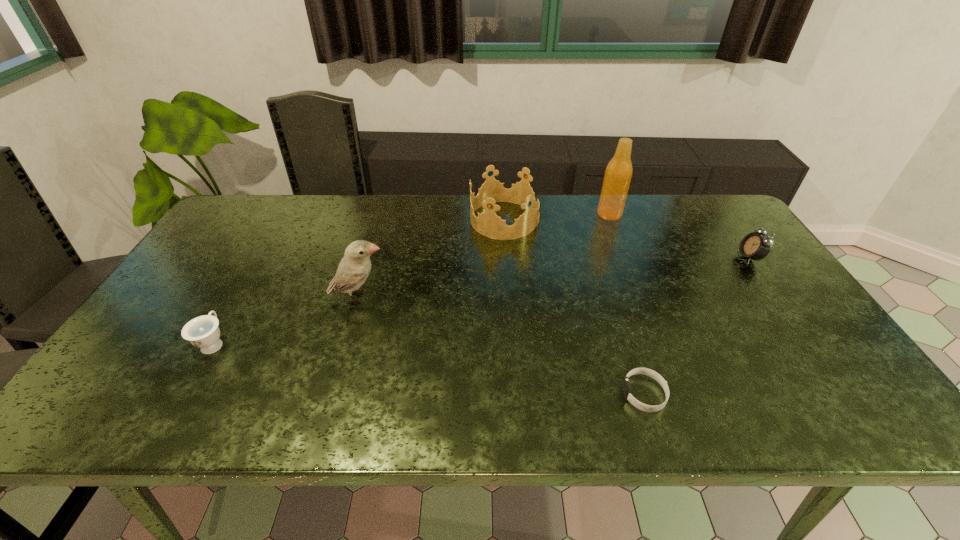
This screenshot has width=960, height=540. Identify the location of vacant area at the far edge. (x=396, y=208).

The image size is (960, 540). Identify the location of free space at the near edge of the desktop. (479, 398).

You are a GUI agent. You are given a task and a screenshot of the screen. Output one action in this format:
    pyautogui.click(x=<x>, y=<y>)
    Task: Click on the vacant area at the left edge
    
    Given the screenshot: What is the action you would take?
    pos(224,267)

This screenshot has width=960, height=540. I want to click on vacant space at the right edge of the desktop, so click(786, 334).

Locate an element on the screen. This screenshot has width=960, height=540. free space at the far left corner of the desktop is located at coordinates (257, 225).

In the image, there is a desktop. Where is `vacant area at the far right corner`? vacant area at the far right corner is located at coordinates (691, 214).

Where is `free region at the near right corner`? This screenshot has height=540, width=960. free region at the near right corner is located at coordinates (868, 425).

Where is `free point between the tallest object and the shortest object`? The width and height of the screenshot is (960, 540). free point between the tallest object and the shortest object is located at coordinates (627, 304).

The width and height of the screenshot is (960, 540). I want to click on empty space between the third shortest object and the wristband, so click(x=697, y=326).

Where is `free space between the tiara and the shortest object`? The image size is (960, 540). free space between the tiara and the shortest object is located at coordinates (574, 307).